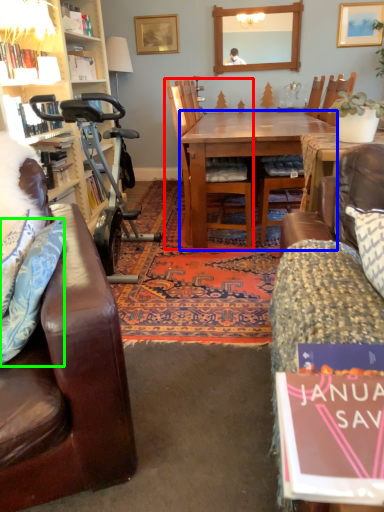
Question: Considering the real-world distances, which object is closest to chair (highlighted by a red box)? desk (highlighted by a blue box) or pillow (highlighted by a green box).

Choices:
 (A) desk
 (B) pillow

Answer: (A)